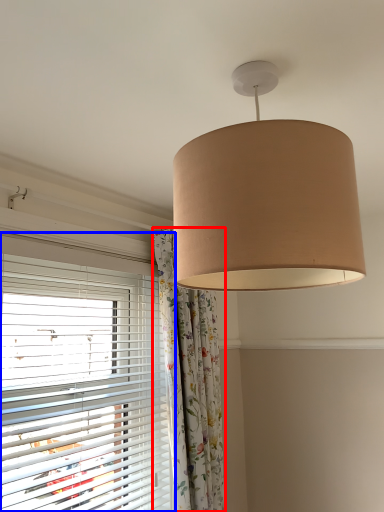
Question: Which object is closer to the camera taking this photo, curtain (highlighted by a red box) or window blind (highlighted by a blue box)?

Choices:
 (A) curtain
 (B) window blind

Answer: (B)